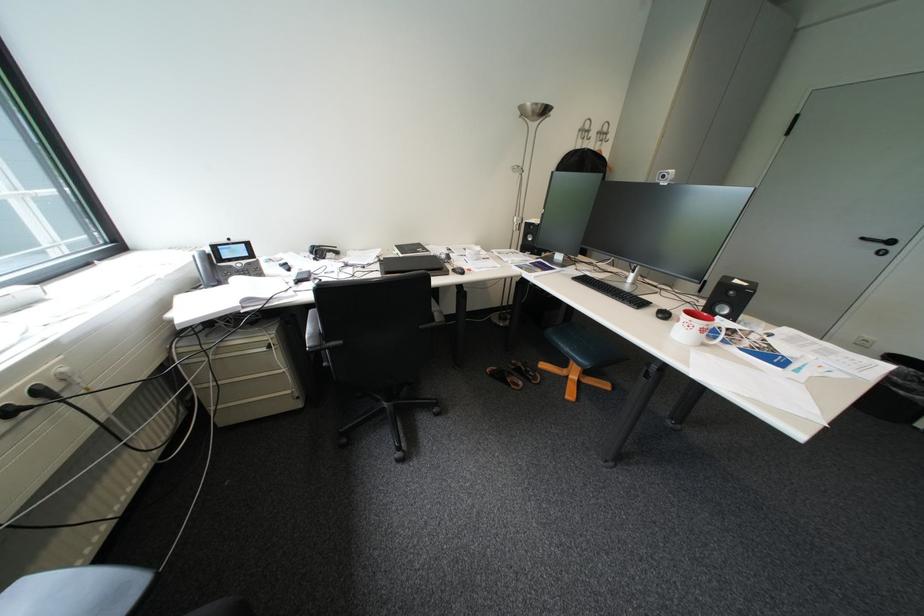
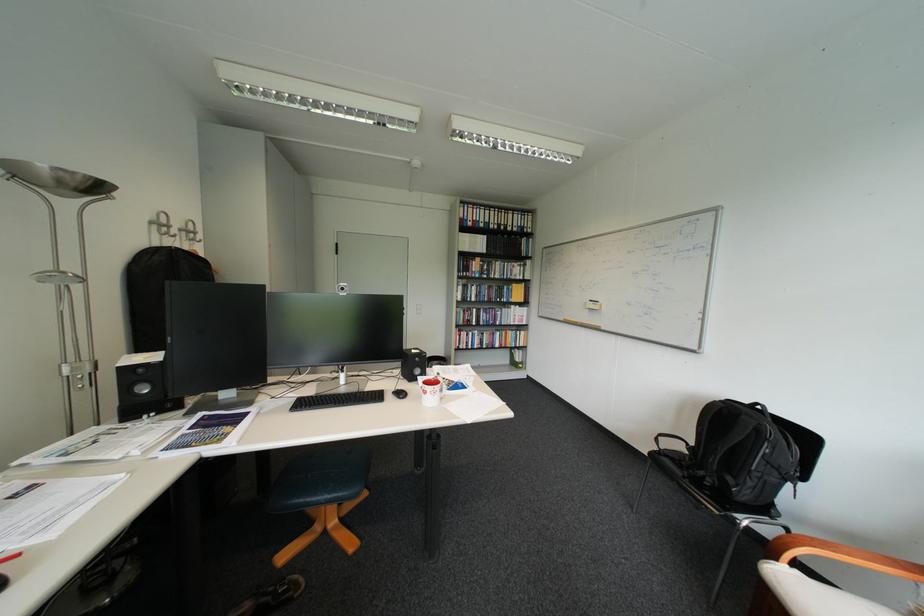
The point at (569, 341) is marked in the first image. Where is the corresponding point in the second image?

(313, 501)